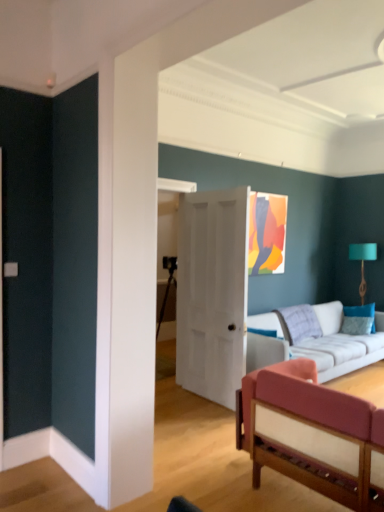
The height and width of the screenshot is (512, 384). Find the location of `free region under white matte door at center (from a real-world perspective)`. free region under white matte door at center (from a real-world perspective) is located at coordinates (195, 397).